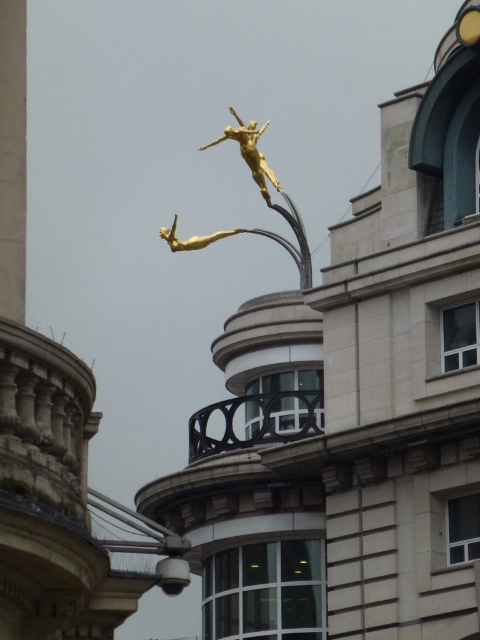
How distant is smooth white pillar at left from gold metallic statue at center?

smooth white pillar at left and gold metallic statue at center are 49.48 meters apart.

Measure the distance between point [11,32] and camera.

67.70 meters

This screenshot has width=480, height=640. Find the location of `smooth white pillar at left`. smooth white pillar at left is located at coordinates (12, 157).

Who is more distant from viewer, [0,32] or [176,243]?

Point [176,243]

This screenshot has height=640, width=480. Describe the element at coordinates (12, 157) in the screenshot. I see `smooth white pillar at left` at that location.

Find the location of a particular element. Image resolution: width=480 pixels, height=640 pixels. smooth white pillar at left is located at coordinates (12, 157).

Is gold metallic statue at upper center behind gold metallic statue at center?

No, it is in front of gold metallic statue at center.

Between point (245, 147) and point (256, 138), which one is positioned behind?

The point (256, 138) is behind.

I want to click on gold metallic statue at upper center, so click(x=263, y=196).